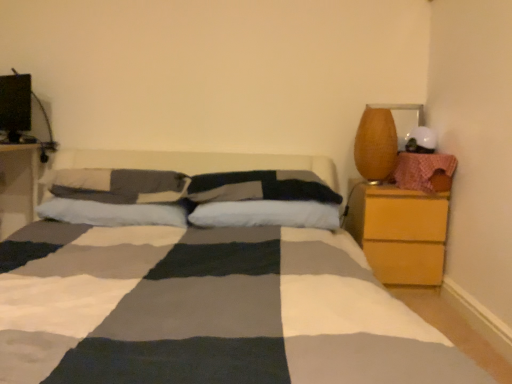
Where is `white soft pillow at center, acting as the second pillow starting from the left`? This screenshot has width=512, height=384. white soft pillow at center, acting as the second pillow starting from the left is located at coordinates (113, 213).

Identify the location of matte brown vase at right. (376, 144).

The width and height of the screenshot is (512, 384). Identify the location of wooden nightstand at right, the 1th nightstand positioned from the right. (399, 232).

Describe the element at coordinates (118, 185) in the screenshot. I see `white cotton pillow at center, the 1th pillow when ordered from left to right` at that location.

What is the approximate height of wooden nightstand at left, which is the 2th nightstand in right-to-left order?

25.23 inches.

This screenshot has height=384, width=512. I want to click on wooden nightstand at left, the 1th nightstand from the left, so click(18, 186).

The height and width of the screenshot is (384, 512). What do you see at coordinates (267, 214) in the screenshot?
I see `white soft pillow at center, which is the 1th pillow in right-to-left order` at bounding box center [267, 214].

At what (x,y) coordinates should I click in order to perform the action: click on soft cotton pillow at center, the 3th pillow in the left-to-right sequence. Please return your answer as a coordinate pair (x, y). Looking at the image, I should click on (261, 187).

Is white soft pillow at center, placed as the fourth pillow when sorted from left to right, positioned with its back to matte brown vase at right?

No, white soft pillow at center, placed as the fourth pillow when sorted from left to right,'s orientation is not away from matte brown vase at right.

In the scene shown: How different are the orientations of white soft pillow at center, which is the 1th pillow in right-to-left order, and matte brown vase at right in degrees?

The facing directions of white soft pillow at center, which is the 1th pillow in right-to-left order, and matte brown vase at right are 4.11 degrees apart.

Would you say white soft pillow at center, placed as the fourth pillow when sorted from left to right, contains matte brown vase at right?

No, white soft pillow at center, placed as the fourth pillow when sorted from left to right, does not contain matte brown vase at right.

Is white soft pillow at center, which is the 1th pillow in right-to-left order, not close to matte brown vase at right?

That's not correct — white soft pillow at center, which is the 1th pillow in right-to-left order, is a little close to matte brown vase at right.

From the picture: Could you tell me if wooden nightstand at right, the 2th nightstand positioned from the left, is turned towards matte brown vase at right?

No.

Does wooden nightstand at right, the 1th nightstand positioned from the right, have a lesser height compared to matte brown vase at right?

No, wooden nightstand at right, the 1th nightstand positioned from the right, is not shorter than matte brown vase at right.

Which is in front, point (348, 200) or point (393, 134)?

The point (393, 134) is closer to the camera.

The width and height of the screenshot is (512, 384). I want to click on table lamp that is above the wooden nightstand at right, the 2th nightstand positioned from the left (from the image's perspective), so click(x=376, y=144).

The width and height of the screenshot is (512, 384). In order to click on pillow located above the soft cotton pillow at center, the 3th pillow in the left-to-right sequence (from the image's perspective) in this screenshot , I will do `click(118, 185)`.

Would you consider white cotton pillow at center, positioned as the fourth pillow in right-to-left order, to be distant from soft cotton pillow at center, the 3th pillow in the left-to-right sequence?

No, white cotton pillow at center, positioned as the fourth pillow in right-to-left order, is in close proximity to soft cotton pillow at center, the 3th pillow in the left-to-right sequence.

Which is closer to the camera, (83, 179) or (307, 191)?

Point (307, 191)

Considering the positions of points (34, 174) and (300, 202), is point (34, 174) farther from camera compared to point (300, 202)?

Yes, it is behind point (300, 202).

Relative to white soft pillow at center, which is the 1th pillow in right-to-left order, is wooden nightstand at left, which is the 2th nightstand in right-to-left order, in front or behind?

wooden nightstand at left, which is the 2th nightstand in right-to-left order, is behind white soft pillow at center, which is the 1th pillow in right-to-left order.

Is wooden nightstand at left, which is the 2th nightstand in right-to-left order, situated inside white soft pillow at center, placed as the fourth pillow when sorted from left to right, or outside?

wooden nightstand at left, which is the 2th nightstand in right-to-left order, is outside white soft pillow at center, placed as the fourth pillow when sorted from left to right.

Which of these two, wooden nightstand at left, the 1th nightstand from the left, or white soft pillow at center, which is the 1th pillow in right-to-left order, is thinner?

Thinner between the two is white soft pillow at center, which is the 1th pillow in right-to-left order.

From the image's perspective, is wooden nightstand at left, which is the 2th nightstand in right-to-left order, under white cotton pillow at center, the 1th pillow when ordered from left to right?

Correct, wooden nightstand at left, which is the 2th nightstand in right-to-left order, appears lower than white cotton pillow at center, the 1th pillow when ordered from left to right, in the image.

I want to click on pillow that is the 2nd one when counting upward from the wooden nightstand at left, the 1th nightstand from the left (from the image's perspective), so click(118, 185).

Is wooden nightstand at left, the 1th nightstand from the left, facing towards white cotton pillow at center, the 1th pillow when ordered from left to right?

No, wooden nightstand at left, the 1th nightstand from the left, is not oriented towards white cotton pillow at center, the 1th pillow when ordered from left to right.

In terms of width, does wooden nightstand at left, the 1th nightstand from the left, look wider or thinner when compared to white cotton pillow at center, the 1th pillow when ordered from left to right?

Considering their sizes, wooden nightstand at left, the 1th nightstand from the left, looks broader than white cotton pillow at center, the 1th pillow when ordered from left to right.

Locate an element on the screen. nightstand that appears on the left of white soft pillow at center, the 3th pillow positioned from the right is located at coordinates (18, 186).

Who is bigger, white soft pillow at center, acting as the second pillow starting from the left, or wooden nightstand at left, which is the 2th nightstand in right-to-left order?

wooden nightstand at left, which is the 2th nightstand in right-to-left order.

Is white soft pillow at center, acting as the second pillow starting from the left, facing away from wooden nightstand at left, which is the 2th nightstand in right-to-left order?

No, white soft pillow at center, acting as the second pillow starting from the left, is not facing the opposite direction of wooden nightstand at left, which is the 2th nightstand in right-to-left order.

From the image's perspective, which object appears higher, white soft pillow at center, the 3th pillow positioned from the right, or wooden nightstand at left, which is the 2th nightstand in right-to-left order?

wooden nightstand at left, which is the 2th nightstand in right-to-left order, from the image's perspective.

Could you tell me if wooden nightstand at left, which is the 2th nightstand in right-to-left order, is turned towards matte brown vase at right?

No, wooden nightstand at left, which is the 2th nightstand in right-to-left order, is not facing towards matte brown vase at right.

Measure the distance from wooden nightstand at left, the 1th nightstand from the left, to matte brown vase at right.

wooden nightstand at left, the 1th nightstand from the left, is 1.85 meters from matte brown vase at right.

Does point (36, 202) appear closer or farther from the camera than point (394, 126)?

Clearly, point (36, 202) is more distant from the camera than point (394, 126).

Can you tell me how much wooden nightstand at left, the 1th nightstand from the left, and matte brown vase at right differ in facing direction?

0.632 degrees separate the facing orientations of wooden nightstand at left, the 1th nightstand from the left, and matte brown vase at right.

This screenshot has height=384, width=512. Identify the location of table lamp located on the right of white soft pillow at center, which is the 1th pillow in right-to-left order. (376, 144).

Locate an element on the screen. the 2nd nightstand located beneath the matte brown vase at right (from a real-world perspective) is located at coordinates (399, 232).

Estimate the real-world distances between objects in this image. Which object is further from soft cotton pillow at center, acting as the 2th pillow starting from the right, white soft pillow at center, the 3th pillow positioned from the right, or white cotton pillow at center, positioned as the fourth pillow in right-to-left order?

The object further to soft cotton pillow at center, acting as the 2th pillow starting from the right, is white soft pillow at center, the 3th pillow positioned from the right.

Estimate the real-world distances between objects in this image. Which object is closer to white soft pillow at center, which is the 1th pillow in right-to-left order, white cotton pillow at center, positioned as the fourth pillow in right-to-left order, or wooden nightstand at left, which is the 2th nightstand in right-to-left order?

Based on the image, white cotton pillow at center, positioned as the fourth pillow in right-to-left order, appears to be nearer to white soft pillow at center, which is the 1th pillow in right-to-left order.

Which object lies further to the anchor point wooden nightstand at right, the 1th nightstand positioned from the right, white soft pillow at center, acting as the second pillow starting from the left, or soft cotton pillow at center, acting as the 2th pillow starting from the right?

white soft pillow at center, acting as the second pillow starting from the left, is positioned further to the anchor wooden nightstand at right, the 1th nightstand positioned from the right.

When comparing their distances from white cotton pillow at center, the 1th pillow when ordered from left to right, does white soft pillow at center, acting as the second pillow starting from the left, or soft cotton pillow at center, the 3th pillow in the left-to-right sequence, seem closer?

white soft pillow at center, acting as the second pillow starting from the left, is closer to white cotton pillow at center, the 1th pillow when ordered from left to right.

From the image, which object appears to be farther from white soft pillow at center, placed as the fourth pillow when sorted from left to right, wooden nightstand at left, which is the 2th nightstand in right-to-left order, or white soft pillow at center, the 3th pillow positioned from the right?

Among the two, wooden nightstand at left, which is the 2th nightstand in right-to-left order, is located further to white soft pillow at center, placed as the fourth pillow when sorted from left to right.

When comparing their distances from matte brown vase at right, does white soft pillow at center, acting as the second pillow starting from the left, or wooden nightstand at left, which is the 2th nightstand in right-to-left order, seem further?

wooden nightstand at left, which is the 2th nightstand in right-to-left order.

Which object lies further to the anchor point white soft pillow at center, which is the 1th pillow in right-to-left order, white soft pillow at center, acting as the second pillow starting from the left, or wooden nightstand at right, the 2th nightstand positioned from the left?

wooden nightstand at right, the 2th nightstand positioned from the left, is positioned further to the anchor white soft pillow at center, which is the 1th pillow in right-to-left order.

Looking at this image, considering their positions, is white cotton pillow at center, the 1th pillow when ordered from left to right, positioned further to wooden nightstand at right, the 1th nightstand positioned from the right, than matte brown vase at right?

white cotton pillow at center, the 1th pillow when ordered from left to right, is further to wooden nightstand at right, the 1th nightstand positioned from the right.

At what (x,y) coordinates should I click in order to perform the action: click on table lamp between white soft pillow at center, placed as the fourth pillow when sorted from left to right, and wooden nightstand at right, the 1th nightstand positioned from the right, in the horizontal direction. Please return your answer as a coordinate pair (x, y). This screenshot has height=384, width=512. Looking at the image, I should click on (376, 144).

Where is `table lamp between wooden nightstand at left, which is the 2th nightstand in right-to-left order, and wooden nightstand at right, the 1th nightstand positioned from the right, from left to right`? This screenshot has width=512, height=384. table lamp between wooden nightstand at left, which is the 2th nightstand in right-to-left order, and wooden nightstand at right, the 1th nightstand positioned from the right, from left to right is located at coordinates (376, 144).

You are a GUI agent. You are given a task and a screenshot of the screen. Output one action in this format:
    pyautogui.click(x=<x>, y=<y>)
    Task: Click on the table lamp between white soft pillow at center, the 3th pillow positioned from the right, and wooden nightstand at right, the 2th nightstand positioned from the left, in the horizontal direction
    This screenshot has width=512, height=384.
    Given the screenshot: What is the action you would take?
    pyautogui.click(x=376, y=144)

Locate an element on the screen. This screenshot has width=512, height=384. pillow located between wooden nightstand at left, which is the 2th nightstand in right-to-left order, and white soft pillow at center, acting as the second pillow starting from the left, in the left-right direction is located at coordinates [118, 185].